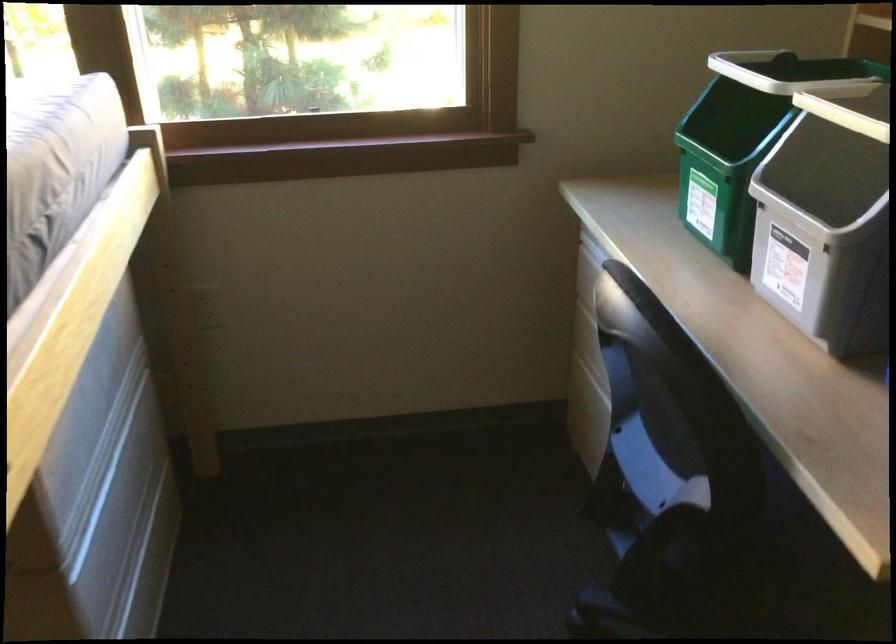
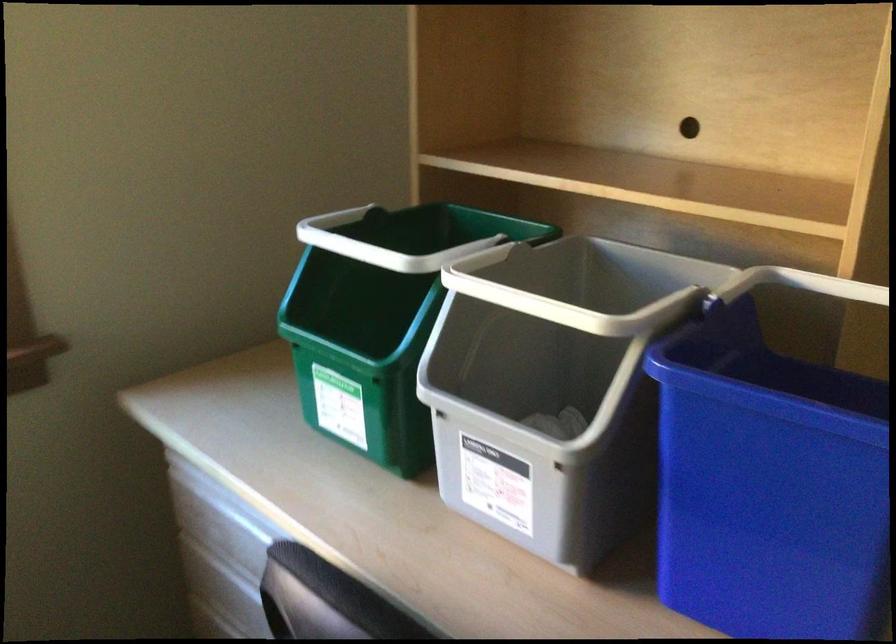
Question: The images are taken continuously from a first-person perspective. In which direction is your viewpoint rotating?

Choices:
 (A) Left
 (B) Right
 (C) Up
 (D) Down

Answer: (B)